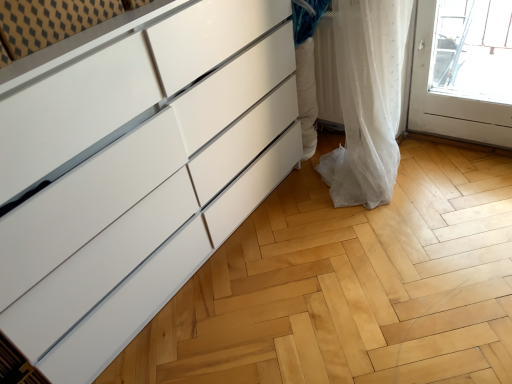
The image size is (512, 384). What do you see at coordinates (137, 172) in the screenshot?
I see `white glossy chest of drawers at left` at bounding box center [137, 172].

Locate an element on the screen. Image resolution: width=512 pixels, height=384 pixels. white glossy chest of drawers at left is located at coordinates (137, 172).

What do you see at coordinates (369, 97) in the screenshot? This screenshot has width=512, height=384. I see `white sheer curtain at lower right` at bounding box center [369, 97].

Locate an element on the screen. This screenshot has width=512, height=384. white sheer curtain at lower right is located at coordinates (369, 97).

At what (x,y) coordinates should I click in order to perform the action: click on white glossy chest of drawers at left. Please return your answer as a coordinate pair (x, y). The height and width of the screenshot is (384, 512). Looking at the image, I should click on (137, 172).

Which object is positioned more to the right, white glossy chest of drawers at left or white sheer curtain at lower right?

From the viewer's perspective, white sheer curtain at lower right appears more on the right side.

Does white glossy chest of drawers at left lie behind white sheer curtain at lower right?

That is False.

Which point is more forward, (141, 154) or (359, 1)?

The point (141, 154) is in front.

From the image's perspective, which is above, white glossy chest of drawers at left or white sheer curtain at lower right?

white sheer curtain at lower right.

From a real-world perspective, which object rests below the other?

white sheer curtain at lower right.

In the scene shown: Which object is thinner, white glossy chest of drawers at left or white sheer curtain at lower right?

white glossy chest of drawers at left.

Considering the sizes of objects white glossy chest of drawers at left and white sheer curtain at lower right in the image provided, who is shorter, white glossy chest of drawers at left or white sheer curtain at lower right?

white sheer curtain at lower right is shorter.

Is white glossy chest of drawers at left smaller than white sheer curtain at lower right?

Incorrect, white glossy chest of drawers at left is not smaller in size than white sheer curtain at lower right.

Is white sheer curtain at lower right located within white glossy chest of drawers at left?

Definitely not — white sheer curtain at lower right is not inside white glossy chest of drawers at left.

Is white glossy chest of drawers at left beside white sheer curtain at lower right?

white glossy chest of drawers at left and white sheer curtain at lower right are clearly separated.

Is white glossy chest of drawers at left oriented away from white sheer curtain at lower right?

white glossy chest of drawers at left does not have its back to white sheer curtain at lower right.

Locate an element on the screen. The height and width of the screenshot is (384, 512). curtain above the white glossy chest of drawers at left (from the image's perspective) is located at coordinates click(x=369, y=97).

Does white sheer curtain at lower right appear on the left side of white glossy chest of drawers at left?

Incorrect, white sheer curtain at lower right is not on the left side of white glossy chest of drawers at left.

Does white sheer curtain at lower right come in front of white glossy chest of drawers at left?

That is False.

Which point is more forward, (374, 12) or (158, 77)?

The point (158, 77) is closer.

From the image's perspective, is white sheer curtain at lower right positioned above or below white glossy chest of drawers at left?

white sheer curtain at lower right is above white glossy chest of drawers at left.

From a real-world perspective, which is physically below, white sheer curtain at lower right or white glossy chest of drawers at left?

From a 3D spatial view, white sheer curtain at lower right is below.

Considering the sizes of objects white sheer curtain at lower right and white glossy chest of drawers at left in the image provided, who is wider, white sheer curtain at lower right or white glossy chest of drawers at left?

white sheer curtain at lower right.

In terms of height, does white sheer curtain at lower right look taller or shorter compared to white glossy chest of drawers at left?

Considering their sizes, white sheer curtain at lower right has less height than white glossy chest of drawers at left.

Is white sheer curtain at lower right bigger than white glossy chest of drawers at left?

Actually, white sheer curtain at lower right might be smaller than white glossy chest of drawers at left.

Is white sheer curtain at lower right not inside white glossy chest of drawers at left?

Yes, white sheer curtain at lower right is located beyond the bounds of white glossy chest of drawers at left.

Is white sheer curtain at lower right placed right next to white glossy chest of drawers at left?

No, white sheer curtain at lower right is not making contact with white glossy chest of drawers at left.

Is white glossy chest of drawers at left at the back of white sheer curtain at lower right?

white sheer curtain at lower right does not have its back to white glossy chest of drawers at left.

How many degrees apart are the facing directions of white sheer curtain at lower right and white glossy chest of drawers at left?

The facing directions of white sheer curtain at lower right and white glossy chest of drawers at left are 88.7 degrees apart.

Locate an element on the screen. This screenshot has width=512, height=384. curtain below the white glossy chest of drawers at left (from a real-world perspective) is located at coordinates (369, 97).

You are a GUI agent. You are given a task and a screenshot of the screen. Output one action in this format:
    pyautogui.click(x=<x>, y=<y>)
    Task: Click on the curtain above the white glossy chest of drawers at left (from the image's perspective)
    
    Given the screenshot: What is the action you would take?
    pyautogui.click(x=369, y=97)

In order to click on chest of drawers on the left of white sheer curtain at lower right in this screenshot , I will do `click(137, 172)`.